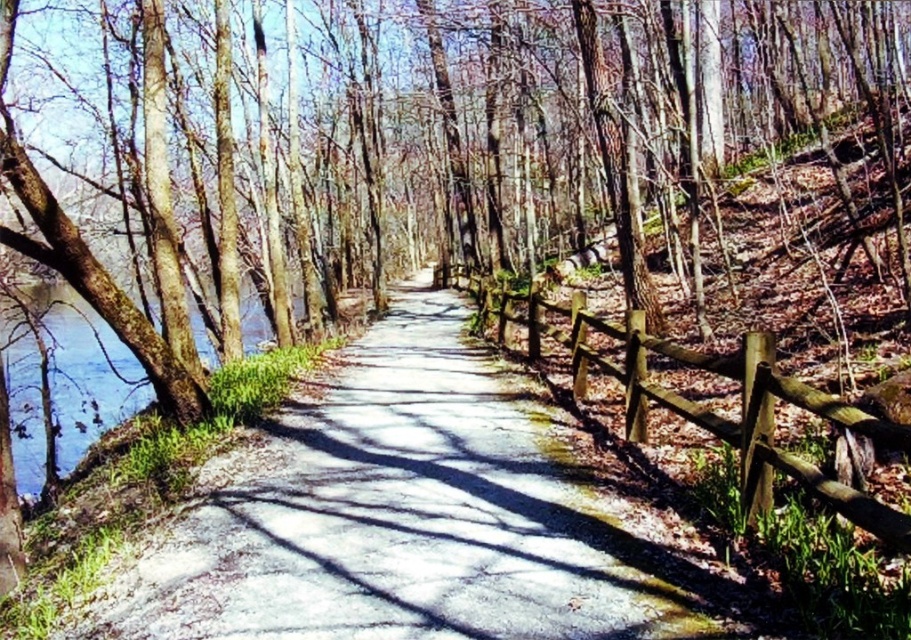
Question: Is smooth concrete path at center below brown wooden fence at right?

Choices:
 (A) yes
 (B) no

Answer: (A)

Question: Can you confirm if smooth concrete path at center is positioned above brown wooden fence at right?

Choices:
 (A) yes
 (B) no

Answer: (B)

Question: Which point appears closest to the camera in this image?

Choices:
 (A) (473, 592)
 (B) (891, 424)

Answer: (B)

Question: Which of the following is the closest to the observer?

Choices:
 (A) brown wooden fence at right
 (B) smooth concrete path at center

Answer: (A)

Question: Does smooth concrete path at center lie behind brown wooden fence at right?

Choices:
 (A) yes
 (B) no

Answer: (A)